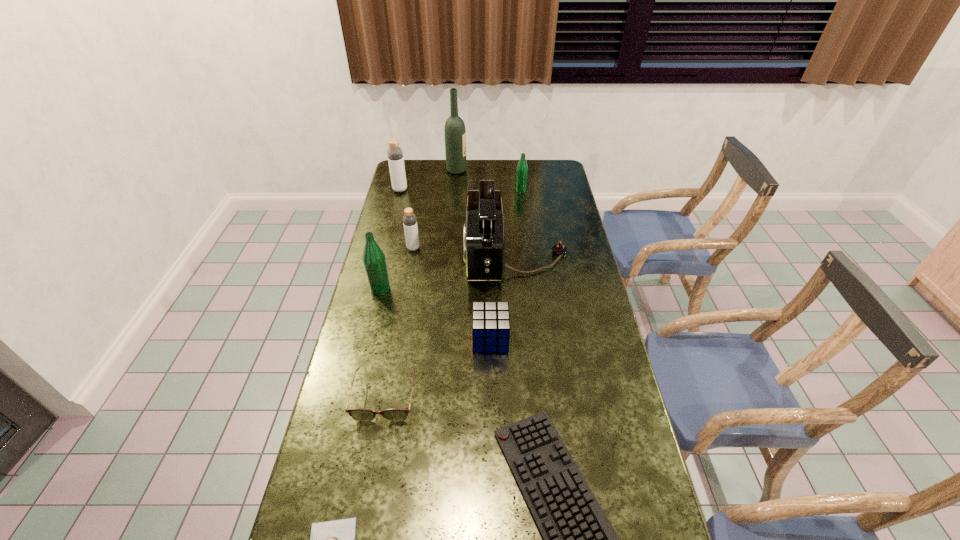
Find the location of a particular element. The image size is (960, 540). free space in the image that satisfies the following two spatial constraints: 1. on the labeled side of the green wine bottle; 2. at the front view of the brown spectacles is located at coordinates (440, 397).